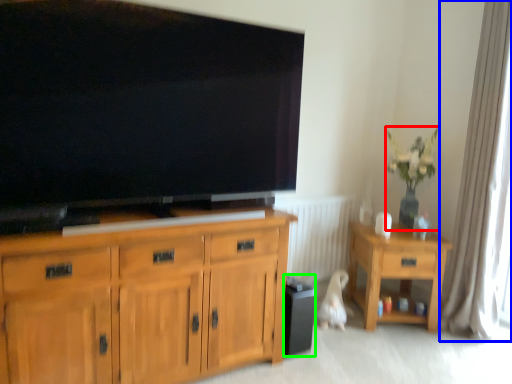
Question: Which object is positioned closest to houseplant (highlighted by a red box)? Select from curtain (highlighted by a blue box) and loudspeaker (highlighted by a green box).

Choices:
 (A) curtain
 (B) loudspeaker

Answer: (A)